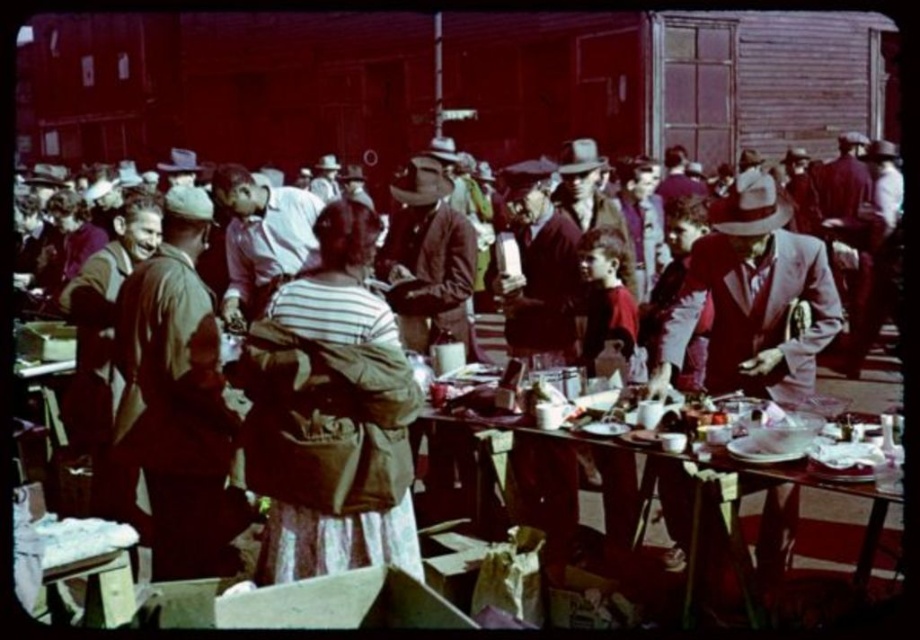
You are standing at the point marked as point [332,224] in the market scene. You want to hand a small package to someone across the market. If you can throw the package 4 meters, will you be able to reach the person?

The distance between you and the viewer is 3.92 meters. Since you can throw 4 meters, you can reach the person.

You are a customer at this market and want to buy both the striped fabric jacket at center and the matte pink shirt at center. Which item is positioned lower on the person wearing them?

The striped fabric jacket at center is below the matte pink shirt at center, so the striped fabric jacket at center is positioned lower on the person wearing them.